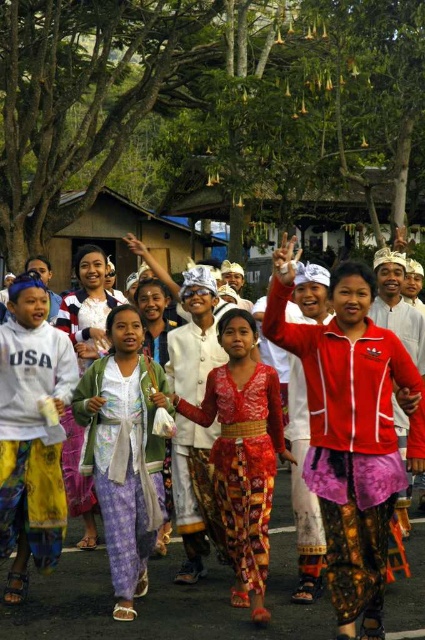
Question: In this image, where is red satin dress at center located relative to light purple batik pants at center?

Choices:
 (A) right
 (B) left

Answer: (A)

Question: Estimate the real-world distances between objects in this image. Which object is closer to the bright red batik dress at center?

Choices:
 (A) red matte jacket at center
 (B) light purple batik pants at center

Answer: (B)

Question: Does red matte jacket at center appear on the left side of bright red batik dress at center?

Choices:
 (A) no
 (B) yes

Answer: (A)

Question: Does red matte jacket at center have a larger size compared to light purple batik pants at center?

Choices:
 (A) yes
 (B) no

Answer: (A)

Question: Which of the following is the closest to the observer?

Choices:
 (A) (232, 516)
 (B) (209, 582)

Answer: (A)

Question: Which point appears farthest from the camera in this image?

Choices:
 (A) (158, 387)
 (B) (280, 547)
 (C) (218, 408)

Answer: (B)